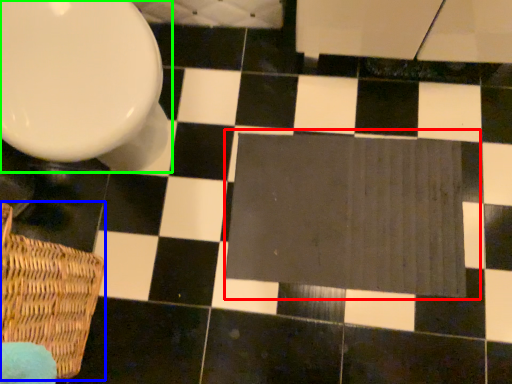
Question: Estimate the real-world distances between objects in this image. Which object is closer to bath mat (highlighted by a red box), basket (highlighted by a blue box) or toilet (highlighted by a green box)?

Choices:
 (A) basket
 (B) toilet

Answer: (B)